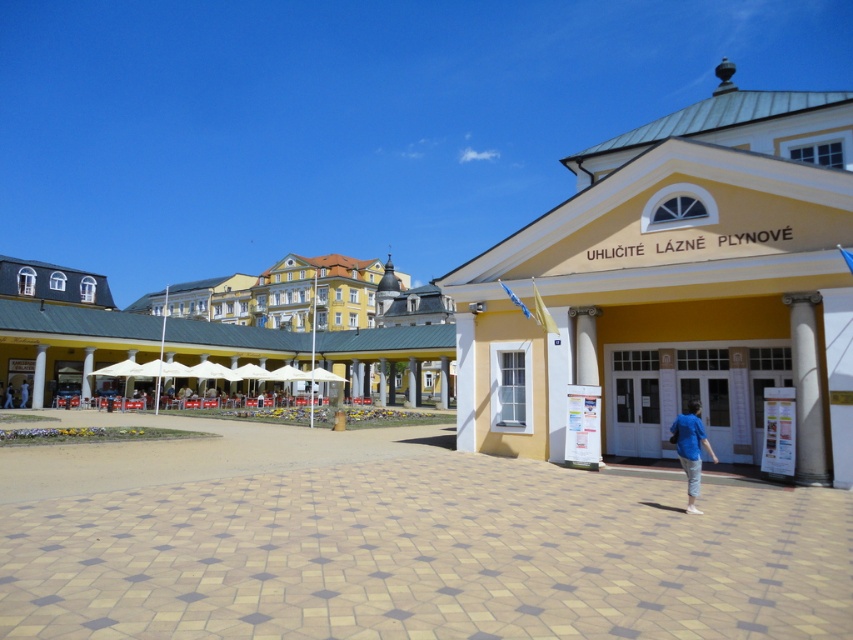
You are standing in front of the spa entrance and want to take a photo of the white marble column at right and the light blue shirt at lower left. Which object should you focus on first to ensure it appears larger in your photo?

You should focus on the white marble column at right first because it is closer to the viewer than the light blue shirt at lower left, making it appear larger in the photo.

You are standing in front of the spa entrance and notice a white marble column at right and a blue cotton shirt at center. Which object is bigger?

The white marble column at right is larger than the blue cotton shirt at center.

You are standing at the entrance of the spa and see two people wearing shirts. One is wearing a blue cotton shirt at center and the other a light blue shirt at lower left. Which person is closer to you?

The blue cotton shirt at center is closer to you because it is in front of the light blue shirt at lower left.